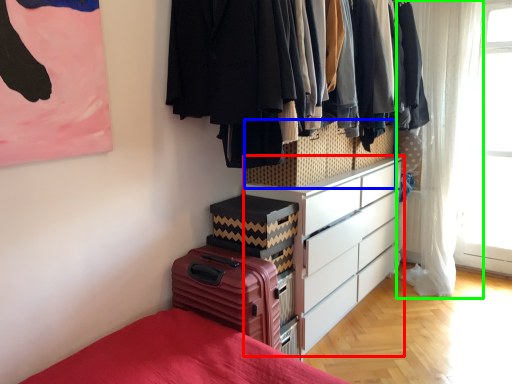
Question: Which object is positioned farthest from chest of drawers (highlighted by a red box)? Select from cabinetry (highlighted by a blue box) and curtain (highlighted by a green box).

Choices:
 (A) cabinetry
 (B) curtain

Answer: (B)